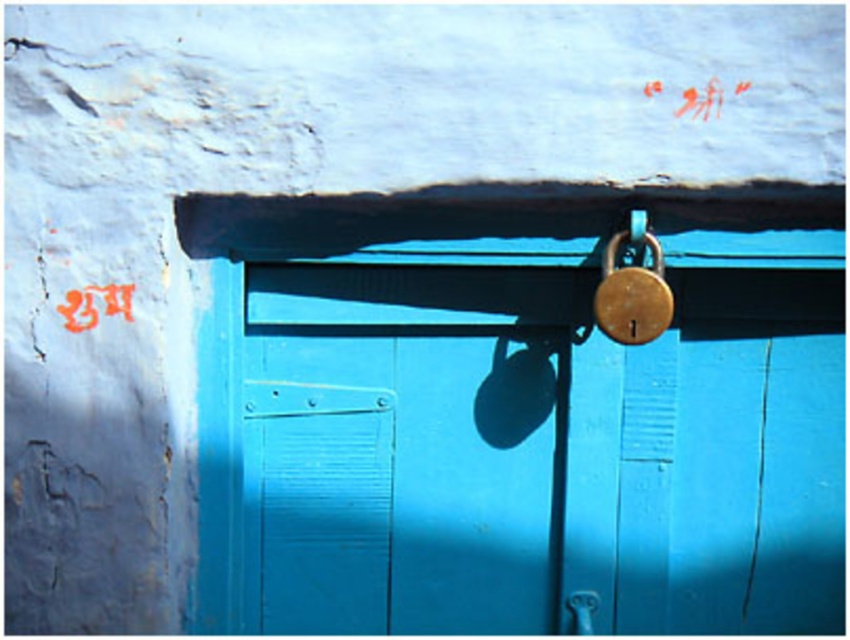
Question: Can you confirm if brushed metal lock at center is positioned above polished silver door handle at lower center?

Choices:
 (A) no
 (B) yes

Answer: (B)

Question: Which point is farther from the camera taking this photo?

Choices:
 (A) 598,595
 (B) 763,605
 (C) 119,304

Answer: (B)

Question: Does blue matte padlock at center appear under polished silver door handle at lower center?

Choices:
 (A) no
 (B) yes

Answer: (A)

Question: Which of the following is the closest to the observer?

Choices:
 (A) (92, 316)
 (B) (660, 387)

Answer: (A)

Question: Does blue matte padlock at center appear on the left side of gold metallic padlock at upper center?

Choices:
 (A) yes
 (B) no

Answer: (A)

Question: Among these points, which one is farthest from the camera?

Choices:
 (A) (82, 305)
 (B) (574, 616)

Answer: (B)